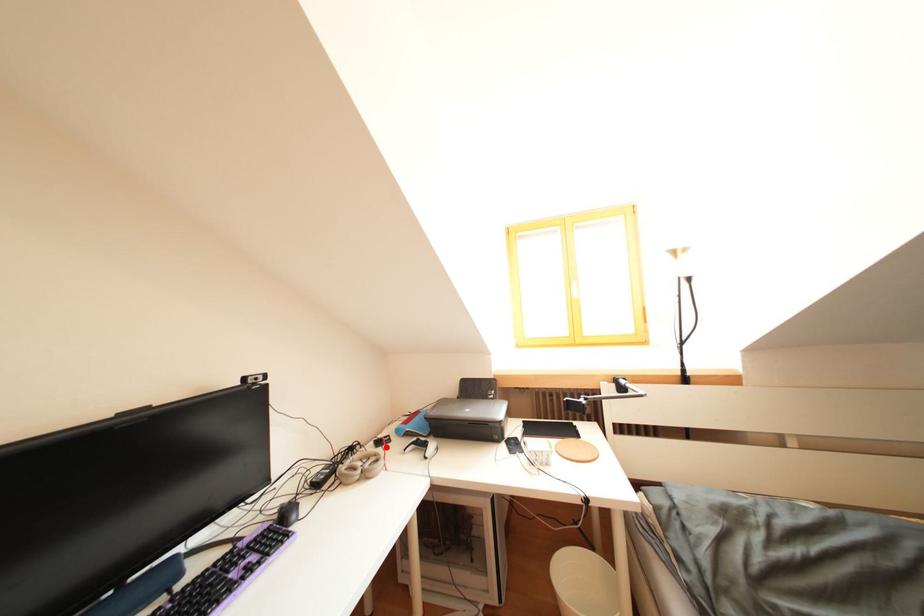
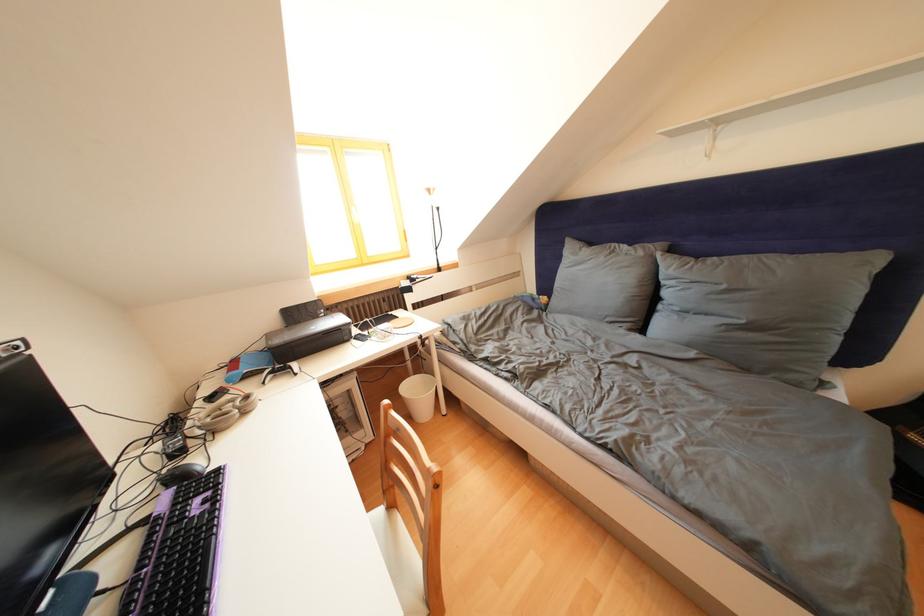
The point at the highlighted location is marked in the first image. Where is the corresponding point in the second image?

(220, 403)